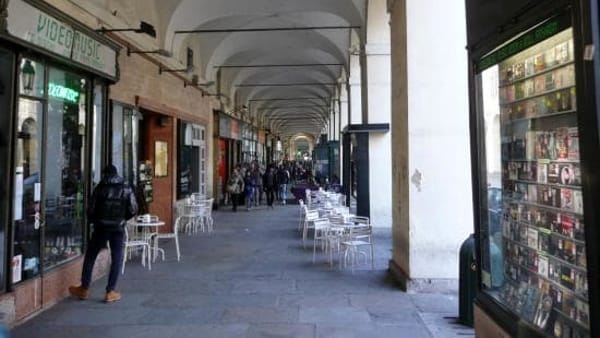
At what (x,y) coordinates should I click in order to perform the action: click on gallery. Please return your answer as a coordinate pair (x, y). Looking at the image, I should click on (296, 100).